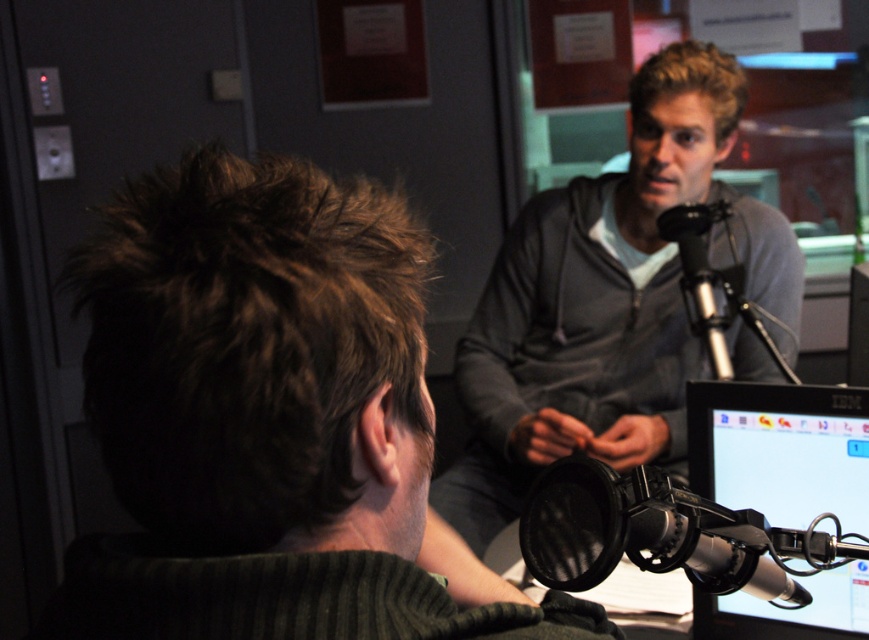
Question: Among these objects, which one is farthest from the camera?

Choices:
 (A) black metallic microphone at center
 (B) black mesh microphone at center
 (C) black glossy monitor at lower right
 (D) gray zip-up hoodie at upper center

Answer: (D)

Question: Can you confirm if black mesh microphone at center is positioned below black metallic microphone at center?

Choices:
 (A) yes
 (B) no

Answer: (A)

Question: Which object appears farthest from the camera in this image?

Choices:
 (A) gray zip-up hoodie at upper center
 (B) black glossy monitor at lower right
 (C) black metallic microphone at center

Answer: (A)

Question: Which object is farther from the camera taking this photo?

Choices:
 (A) black glossy monitor at lower right
 (B) gray zip-up hoodie at upper center

Answer: (B)

Question: Can you confirm if black mesh microphone at center is positioned below black metallic microphone at center?

Choices:
 (A) no
 (B) yes

Answer: (B)

Question: Is black glossy monitor at lower right closer to camera compared to black metallic microphone at center?

Choices:
 (A) no
 (B) yes

Answer: (B)